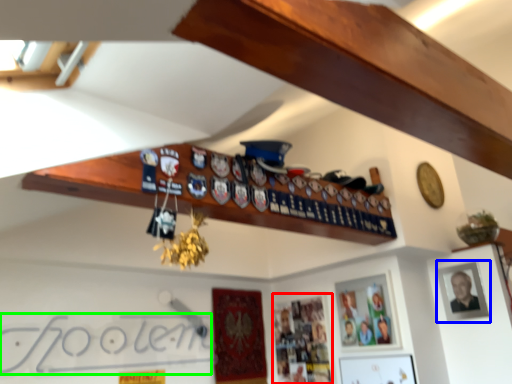
Question: Which object is the farthest from picture frame (highlighted by a red box)? Choose among these: picture frame (highlighted by a blue box) or signature (highlighted by a green box).

Choices:
 (A) picture frame
 (B) signature

Answer: (A)